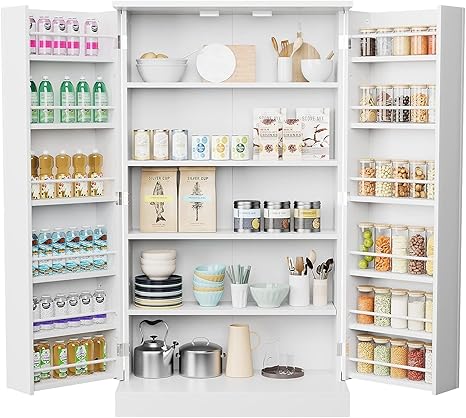
In order to click on bottles on bottom shelf on left side in this screenshot , I will do `click(101, 344)`, `click(90, 349)`, `click(75, 354)`, `click(60, 358)`, `click(45, 359)`, `click(37, 360)`.